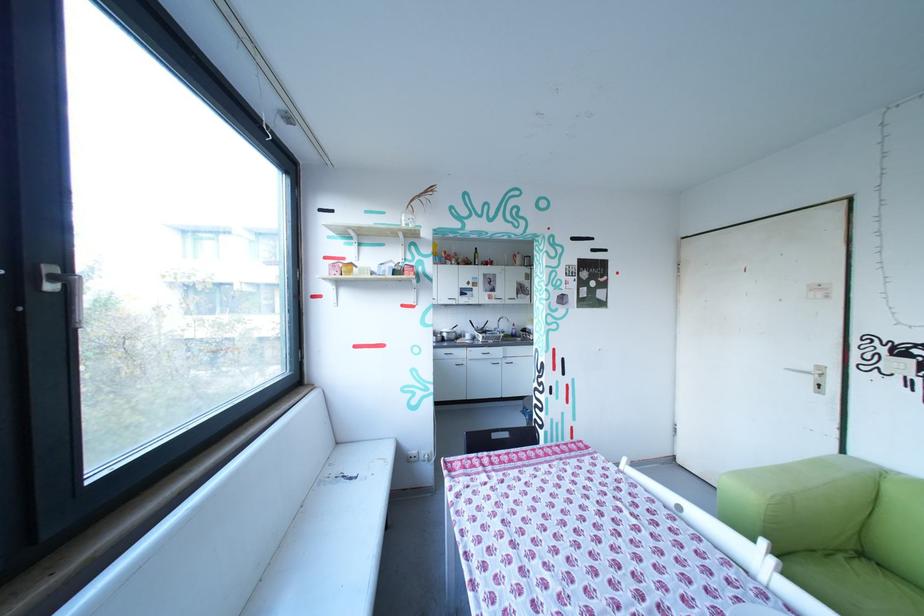
The height and width of the screenshot is (616, 924). Find the location of `black window handle`. black window handle is located at coordinates (11, 281).